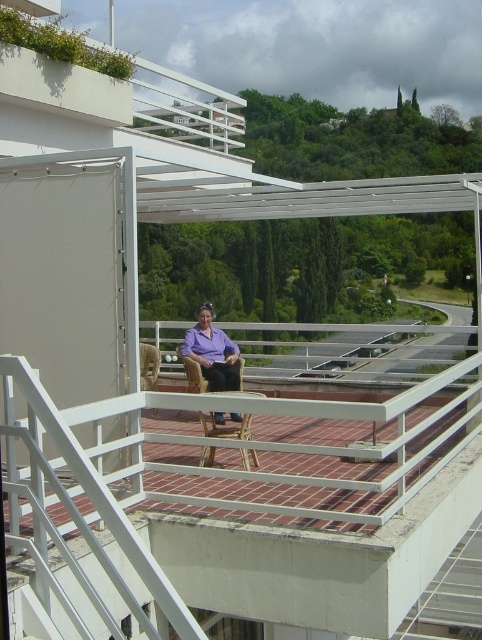
Does purple fabric chair at center have a larger size compared to brown woven chair at center?

Indeed, purple fabric chair at center has a larger size compared to brown woven chair at center.

Consider the image. Can you confirm if purple fabric chair at center is positioned below brown woven chair at center?

Incorrect, purple fabric chair at center is not positioned below brown woven chair at center.

Is point (216, 364) farther from viewer compared to point (219, 429)?

Yes, it is behind point (219, 429).

This screenshot has height=640, width=482. I want to click on purple fabric chair at center, so click(212, 352).